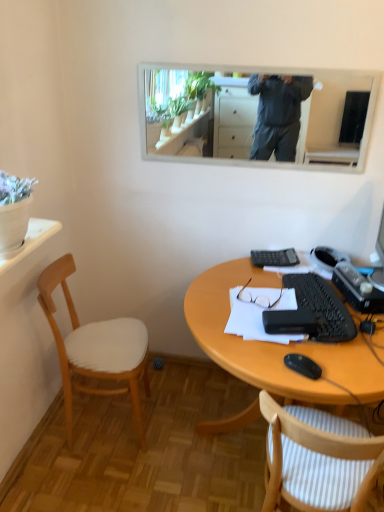
At what (x,y) coordinates should I click in order to perform the action: click on free location in front of wooden chair with white cushion at left, which is counted as the 1th chair, starting from the left. Please return your answer as a coordinate pair (x, y). This screenshot has width=384, height=512. Looking at the image, I should click on (97, 479).